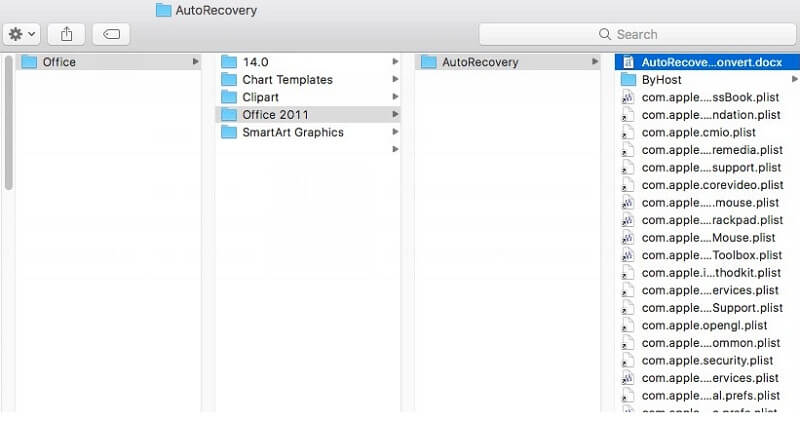
This screenshot has width=800, height=421. I want to click on folders, so click(x=76, y=61), click(x=230, y=57), click(x=266, y=82), click(x=264, y=92), click(x=265, y=114), click(x=262, y=131), click(x=450, y=66), click(x=633, y=77).